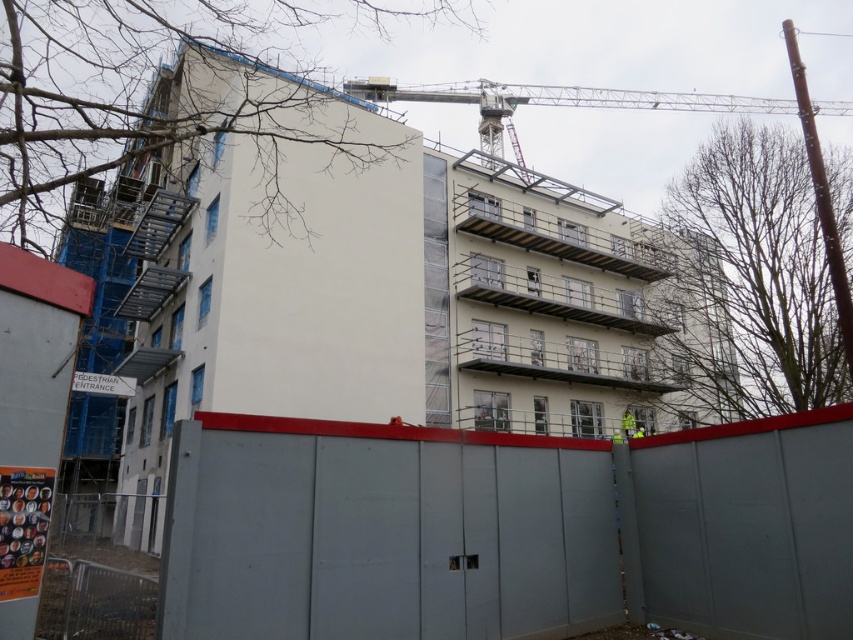
Question: Which of the following is the closest to the observer?

Choices:
 (A) reflective yellow safety vest at center
 (B) gray metal fence at lower center

Answer: (B)

Question: Which point appears closest to the camera in this image?

Choices:
 (A) (628, 417)
 (B) (129, 621)
 (C) (775, 598)

Answer: (B)

Question: Does gray metal fence at lower center come behind metallic silver fence at lower left?

Choices:
 (A) yes
 (B) no

Answer: (B)

Question: Does gray metal fence at lower center have a larger size compared to metallic silver crane at upper center?

Choices:
 (A) no
 (B) yes

Answer: (A)

Question: Which point is closer to the camera taking this photo?

Choices:
 (A) (x=624, y=420)
 (B) (x=378, y=451)

Answer: (B)

Question: Can you confirm if gray metal fence at lower center is positioned above reflective yellow safety vest at center?

Choices:
 (A) yes
 (B) no

Answer: (A)